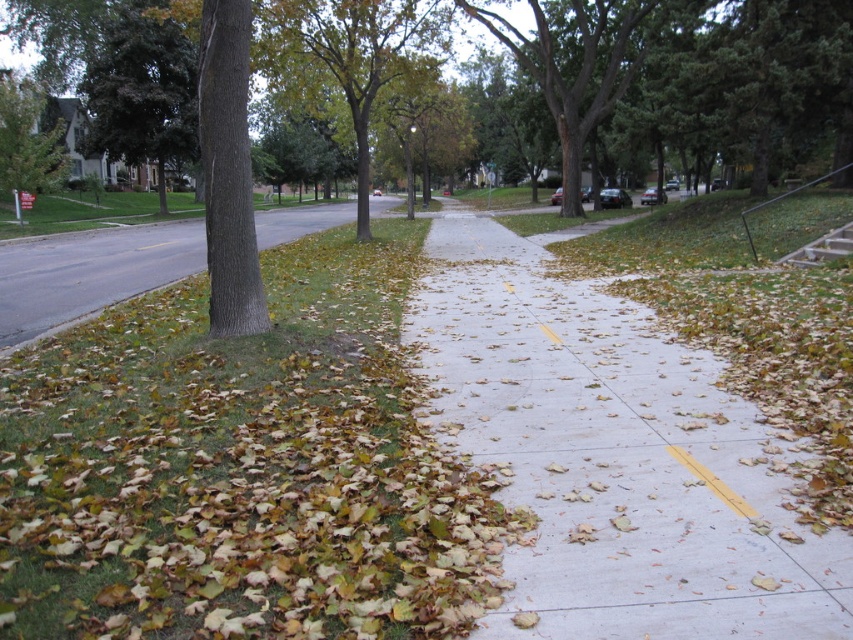
You are a gardener who needs to trim trees. You see two trees in the image, the green leafy tree at left and the green leafy tree at center. Which tree should you prioritize trimming if you want to work on the taller one first?

The green leafy tree at left is taller than the green leafy tree at center, so you should prioritize trimming the green leafy tree at left first.

You are standing on the concrete sidewalk at center and want to look up at the green leafy tree at upper left. Based on their sizes in the image, which one do you think is taller?

The green leafy tree at upper left is taller than the concrete sidewalk at center.